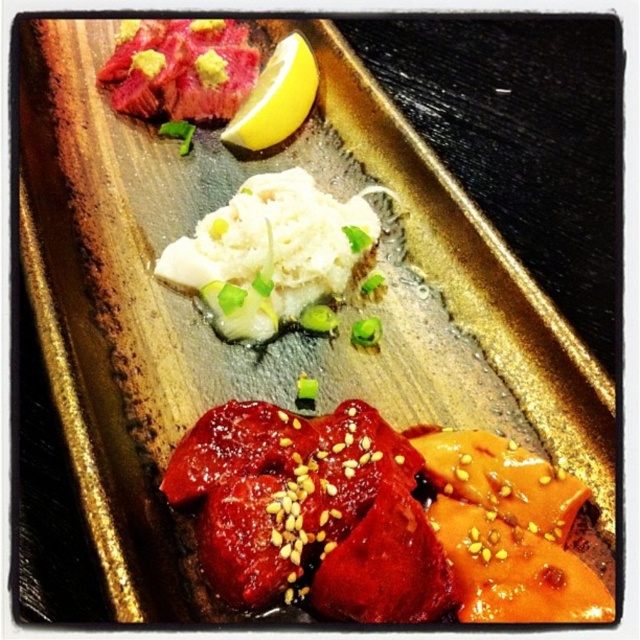
Question: Which point is farther from the camera taking this photo?

Choices:
 (A) [280, 140]
 (B) [280, 186]

Answer: (A)

Question: Can you confirm if white fluffy rice at center is positioned to the right of yellow matte lemon at upper center?

Choices:
 (A) no
 (B) yes

Answer: (B)

Question: Is white fluffy rice at center to the left of yellow matte lemon at upper center from the viewer's perspective?

Choices:
 (A) no
 (B) yes

Answer: (A)

Question: Is white fluffy rice at center behind yellow matte lemon at upper center?

Choices:
 (A) yes
 (B) no

Answer: (B)